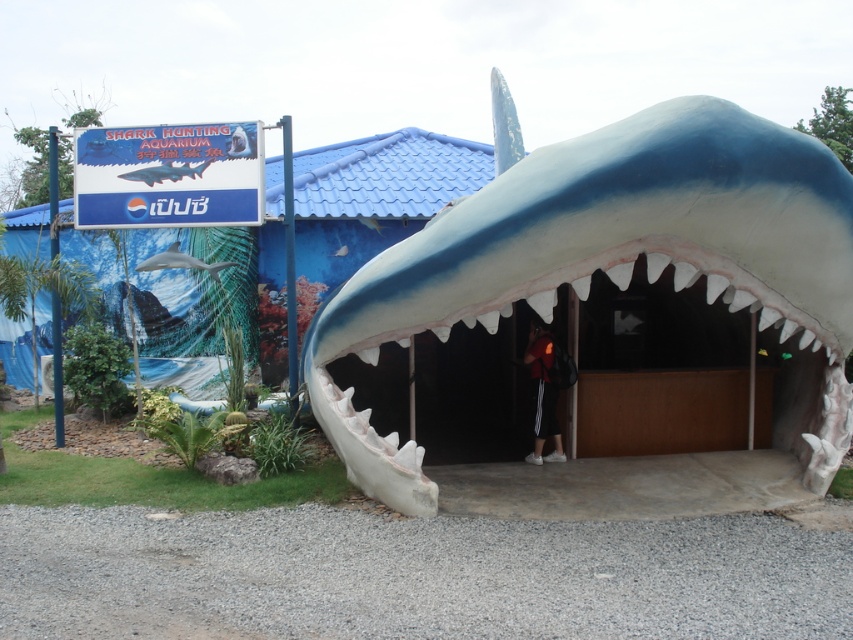
Question: Where is blue matte shark at center located in relation to dark blue hoodie at center in the image?

Choices:
 (A) below
 (B) above

Answer: (B)

Question: Among these objects, which one is nearest to the camera?

Choices:
 (A) blue matte shark at center
 (B) smooth gray shark at upper left

Answer: (B)

Question: Does blue matte shark at center appear on the left side of dark blue hoodie at center?

Choices:
 (A) no
 (B) yes

Answer: (B)

Question: Which object appears farthest from the camera in this image?

Choices:
 (A) white smooth shark at center
 (B) dark blue hoodie at center
 (C) blue matte shark at center
 (D) smooth gray shark at upper left

Answer: (C)

Question: Can you confirm if white smooth shark at center is wider than smooth gray shark at upper left?

Choices:
 (A) no
 (B) yes

Answer: (B)

Question: Which object appears closest to the camera in this image?

Choices:
 (A) dark blue hoodie at center
 (B) smooth gray shark at upper left
 (C) blue matte shark at center

Answer: (A)